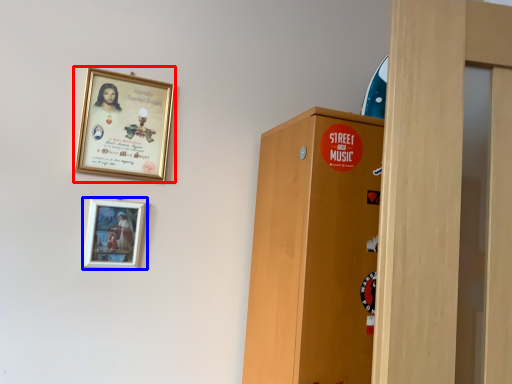
Question: Among these objects, which one is farthest to the camera, picture frame (highlighted by a red box) or picture frame (highlighted by a blue box)?

Choices:
 (A) picture frame
 (B) picture frame

Answer: (A)